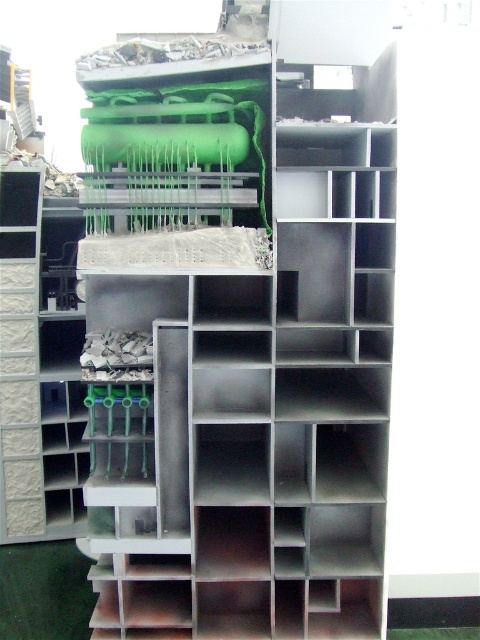
Question: Does metallic gray bookshelf at center have a larger size compared to white textured brick at left?

Choices:
 (A) yes
 (B) no

Answer: (A)

Question: Can you confirm if metallic gray bookshelf at center is positioned below white textured brick at left?

Choices:
 (A) yes
 (B) no

Answer: (B)

Question: Does metallic gray bookshelf at center have a greater width compared to white textured brick at left?

Choices:
 (A) no
 (B) yes

Answer: (B)

Question: Which point is closer to the camera?

Choices:
 (A) white textured brick at left
 (B) metallic gray bookshelf at center

Answer: (B)

Question: Which of the following is the farthest from the observer?

Choices:
 (A) metallic gray bookshelf at center
 (B) white textured brick at left

Answer: (B)

Question: Which point appears closest to the camera in this image?

Choices:
 (A) (299, 632)
 (B) (48, 461)

Answer: (A)